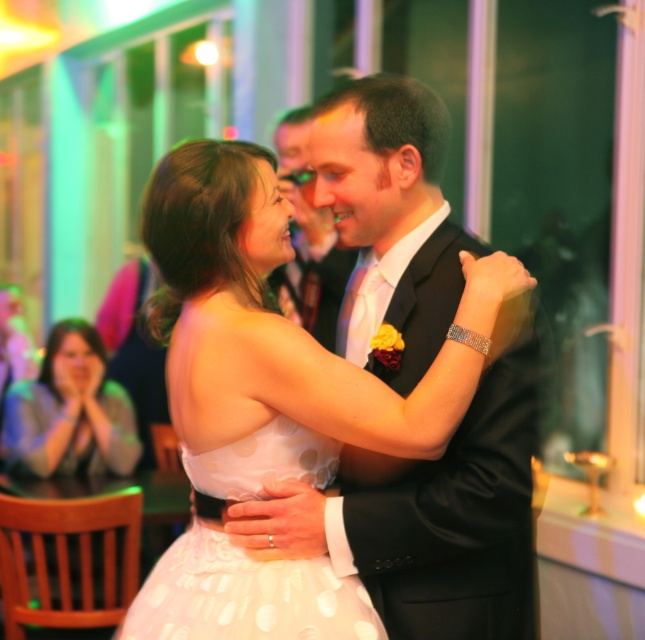
You are a photographer at the wedding reception and want to capture a clear photo of both the white satin dress at center and the white dotted fabric dress at center. Which dress should you focus on to ensure the other is in the background?

You should focus on the white satin dress at center because the white dotted fabric dress at center is behind it, so focusing on the satin dress will keep the dotted one in the background.

You are a photographer at the wedding reception. You want to take a photo of the couple dancing. The couple is located at point (255, 598) and point (313, 257). Which point should you stand behind to ensure both are fully visible in the frame?

You should stand behind point (313, 257) because point (255, 598) is in front of it, so standing behind the latter will allow you to see both points without obstruction.

You are a photographer at the wedding reception and need to position a spotlight to highlight the white dotted fabric dress at center. The spotlight can only illuminate an area within a 0.3 radius from its center. If you place the spotlight at coordinates point A, which is at position 0.5, 0.5, will the dress be illuminated?

The white dotted fabric dress at center is located at point [244,595]. The distance between the spotlight at [322,320] and the dress is sqrt of squared differences in x and y coordinates. Calculating the distance between these points would determine if it is within the 0.3 radius. Since the coordinates are normalized, the Euclidean distance formula applies. Let me compute that. The difference in x is 0.931 minus 0.5 equals 0.431. The difference in y is 0.381 minus 0.5 equals negative 0.119. Squaring both,